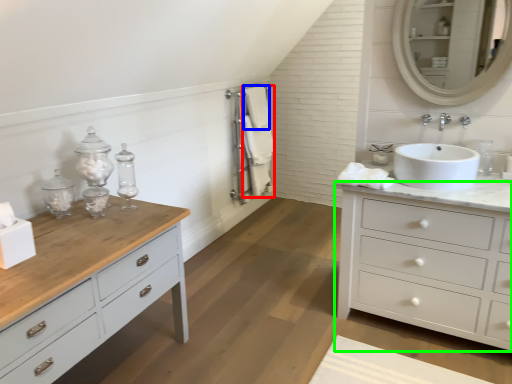
Question: Based on their relative distances, which object is nearer to bath towel (highlighted by a red box)? Choose from bath towel (highlighted by a blue box) and chest of drawers (highlighted by a green box).

Choices:
 (A) bath towel
 (B) chest of drawers

Answer: (A)